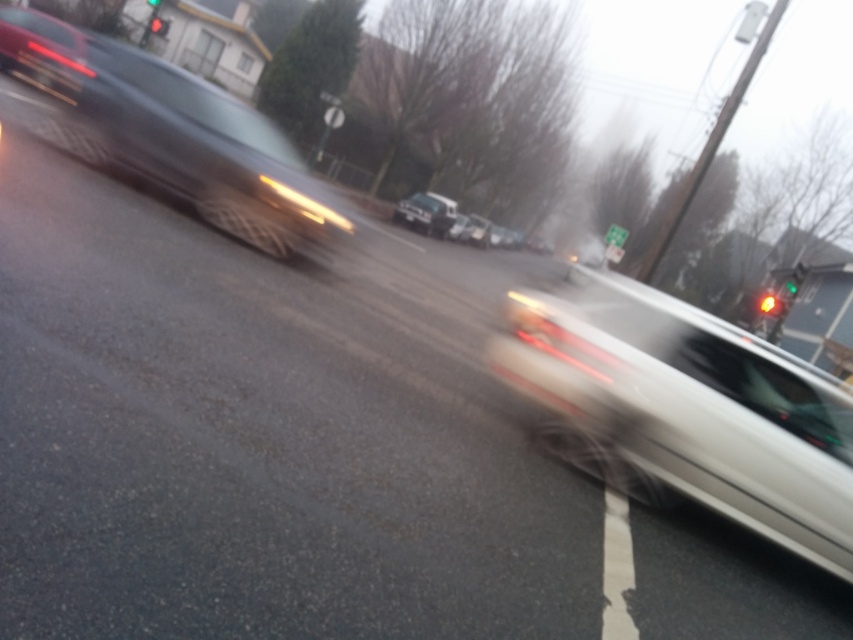
Does amber glass traffic light at center appear on the right side of red glass traffic light at upper center?

Correct, you'll find amber glass traffic light at center to the right of red glass traffic light at upper center.

Is amber glass traffic light at center taller than red glass traffic light at upper center?

Incorrect, amber glass traffic light at center's height is not larger of red glass traffic light at upper center's.

Is point (762, 300) positioned after point (149, 26)?

No, it is in front of (149, 26).

You are a GUI agent. You are given a task and a screenshot of the screen. Output one action in this format:
    pyautogui.click(x=<x>, y=<y>)
    Task: Click on the amber glass traffic light at center
    This screenshot has height=640, width=853.
    Given the screenshot: What is the action you would take?
    pyautogui.click(x=770, y=305)

Does metallic silver car at left lie in front of green glass traffic light at upper right?

Yes.

Who is positioned more to the left, metallic silver car at left or green glass traffic light at upper right?

metallic silver car at left

Where is `metallic silver car at left`? The width and height of the screenshot is (853, 640). metallic silver car at left is located at coordinates (202, 148).

Which is behind, point (329, 196) or point (776, 301)?

The point (776, 301) is behind.

Is metallic silver car at left shorter than amber glass traffic light at center?

Incorrect, metallic silver car at left's height does not fall short of amber glass traffic light at center's.

Where is `metallic silver car at left`? This screenshot has width=853, height=640. metallic silver car at left is located at coordinates (202, 148).

In order to click on metallic silver car at left in this screenshot , I will do `click(202, 148)`.